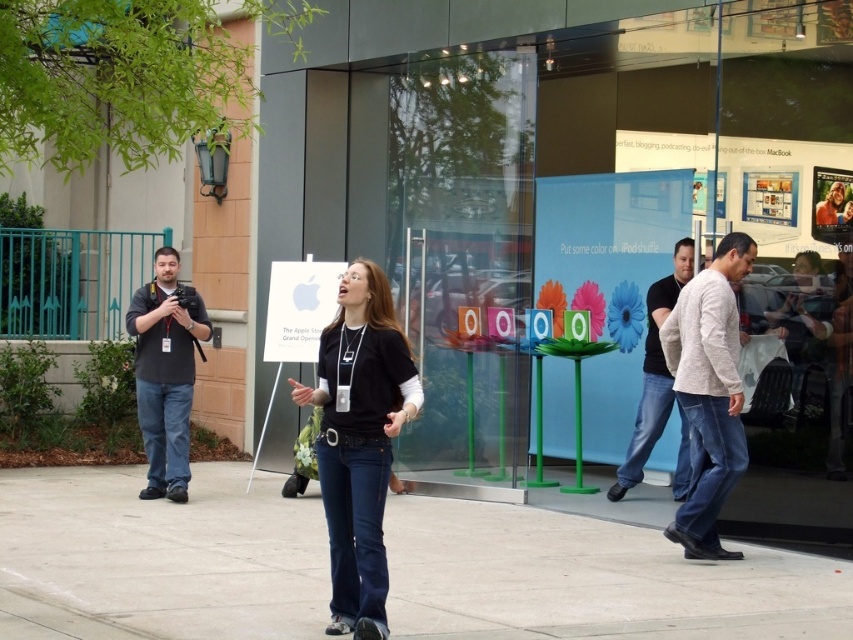
Can you confirm if black fabric camera at left is positioned to the right of matte black shirt at center?

In fact, black fabric camera at left is to the left of matte black shirt at center.

How much distance is there between black fabric camera at left and matte black shirt at center?

A distance of 6.23 meters exists between black fabric camera at left and matte black shirt at center.

Who is more distant from viewer, (169, 442) or (833, 188)?

The point (169, 442) is more distant.

Where is `black fabric camera at left`? black fabric camera at left is located at coordinates (165, 372).

Does black cotton shirt at center have a greater height compared to matte black shirt at center?

Yes.

Between black cotton shirt at center and matte black shirt at center, which one has less height?

Standing shorter between the two is matte black shirt at center.

This screenshot has width=853, height=640. In order to click on black cotton shirt at center in this screenshot , I will do `click(653, 372)`.

Which is more to the left, smooth concrete pavement at center or black cotton shirt at center?

smooth concrete pavement at center is more to the left.

Between smooth concrete pavement at center and black cotton shirt at center, which one has more height?

black cotton shirt at center is taller.

Does point (630, 596) come farther from viewer compared to point (679, 483)?

That is False.

This screenshot has height=640, width=853. I want to click on smooth concrete pavement at center, so click(158, 557).